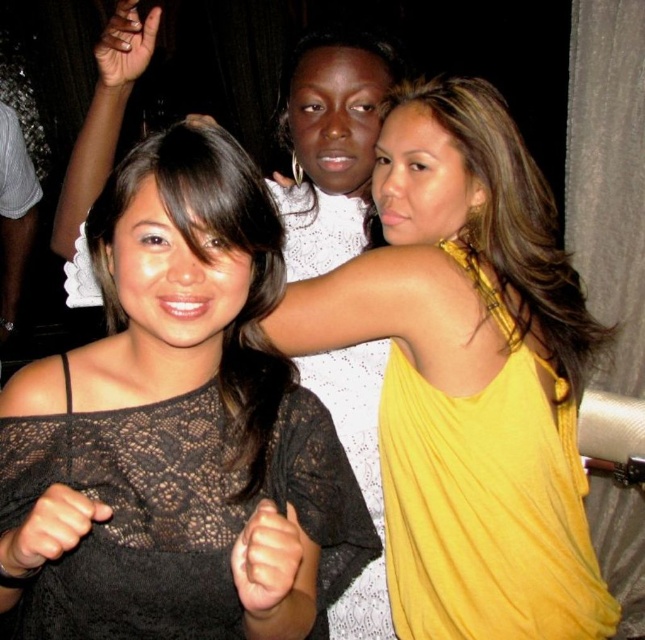
Question: Can you confirm if yellow satin dress at center is positioned below white lace dress at center?

Choices:
 (A) yes
 (B) no

Answer: (B)

Question: Can you confirm if black lace top at center is thinner than yellow satin dress at center?

Choices:
 (A) yes
 (B) no

Answer: (A)

Question: Is black lace top at center further to the viewer compared to white lace dress at center?

Choices:
 (A) yes
 (B) no

Answer: (B)

Question: Which of these objects is positioned farthest from the black lace top at center?

Choices:
 (A) yellow silky dress at upper right
 (B) yellow satin dress at center
 (C) white lace dress at center

Answer: (C)

Question: Which point is closer to the camera?

Choices:
 (A) yellow satin dress at center
 (B) yellow silky dress at upper right

Answer: (A)

Question: Among these points, which one is nearest to the camera?

Choices:
 (A) (437, 481)
 (B) (348, 529)
 (C) (326, 397)
 (D) (488, 580)

Answer: (B)